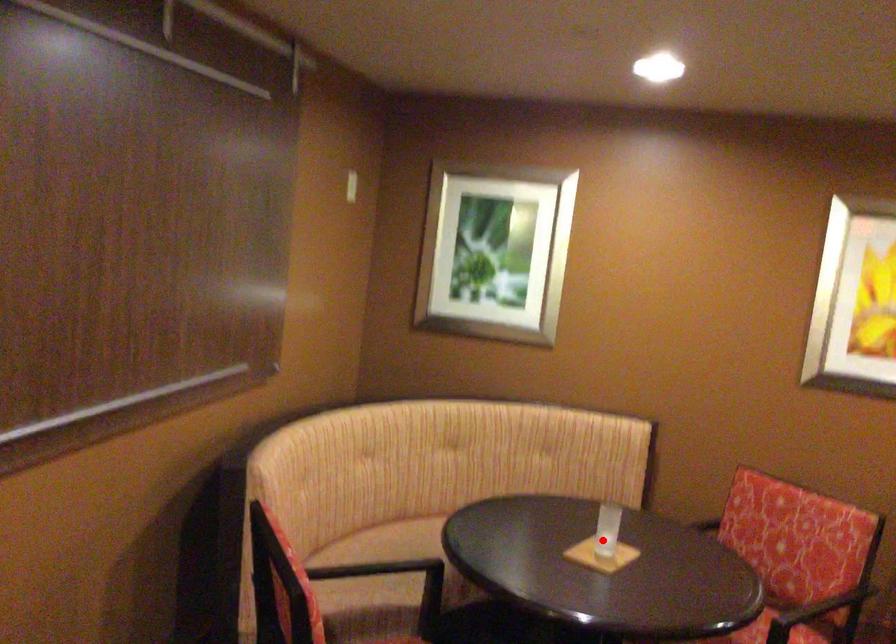
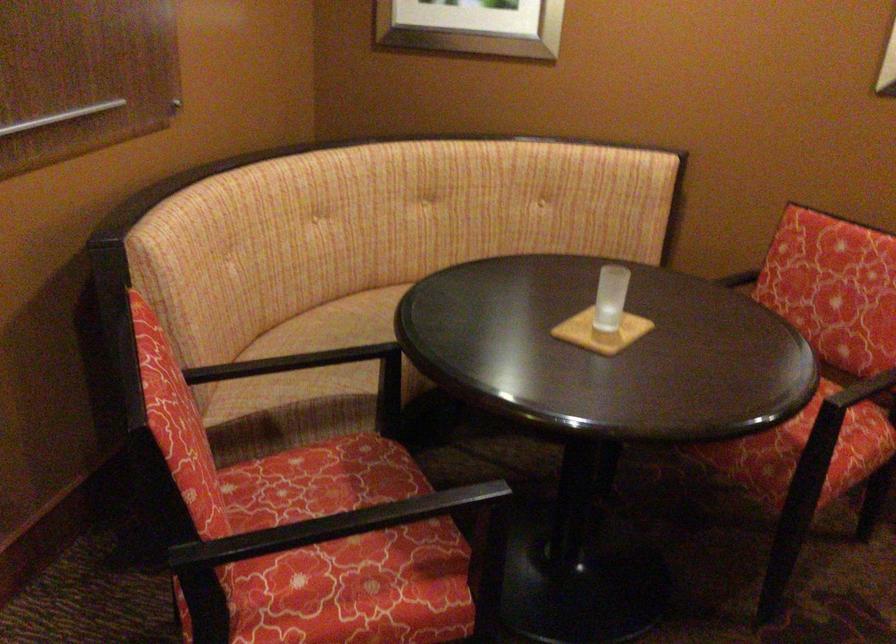
Question: I am providing you with two images of the same scene from different viewpoints. In image1, a red point is highlighted. Considering the same 3D point in image2, which of the following is correct?

Choices:
 (A) It is closer
 (B) It is farther

Answer: (A)